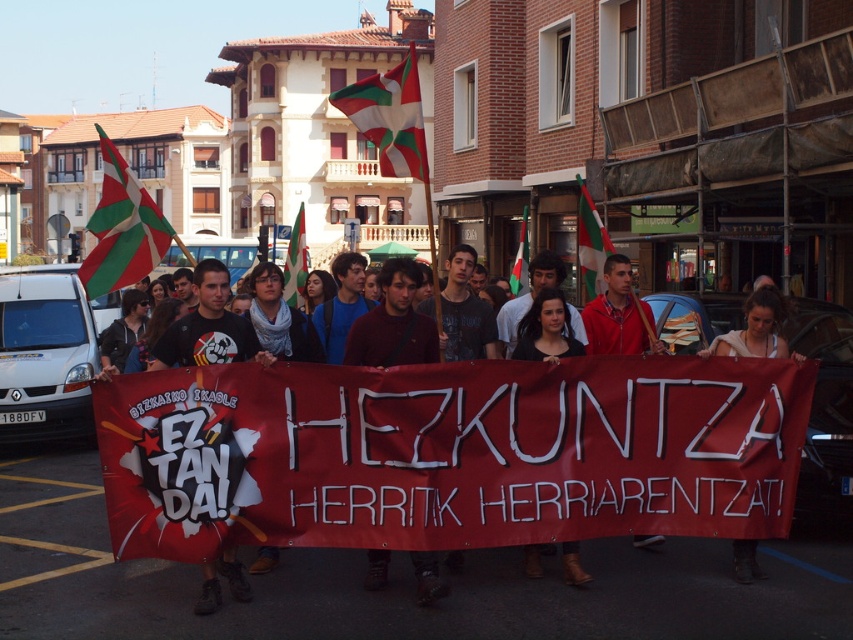
Can you confirm if white fabric banner at center is positioned above green and white striped flag at center?

No.

Which is in front, point (755, 566) or point (593, 216)?

Point (755, 566)

I want to click on white fabric banner at center, so click(756, 328).

At what (x,y) coordinates should I click in order to perform the action: click on white fabric banner at center. Please return your answer as a coordinate pair (x, y). Image resolution: width=853 pixels, height=640 pixels. Looking at the image, I should click on (756, 328).

Which is below, matte black t-shirt at center or green and white striped flag at upper center?

matte black t-shirt at center

The image size is (853, 640). Identify the location of matte black t-shirt at center. (445, 456).

Is green and white striped flag at center positioned in front of green fabric flag at center?

Yes, green and white striped flag at center is in front of green fabric flag at center.

Is green and white striped flag at center to the right of green fabric flag at center from the viewer's perspective?

In fact, green and white striped flag at center is to the left of green fabric flag at center.

Does point (585, 228) lie in front of point (523, 244)?

Yes, point (585, 228) is closer to viewer.

Locate an element on the screen. The height and width of the screenshot is (640, 853). green and white striped flag at center is located at coordinates (590, 243).